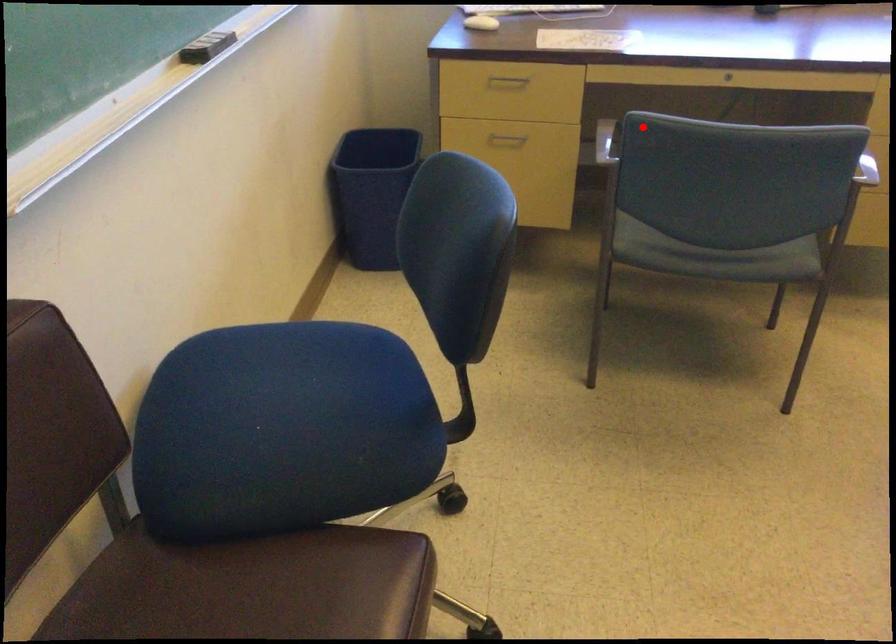
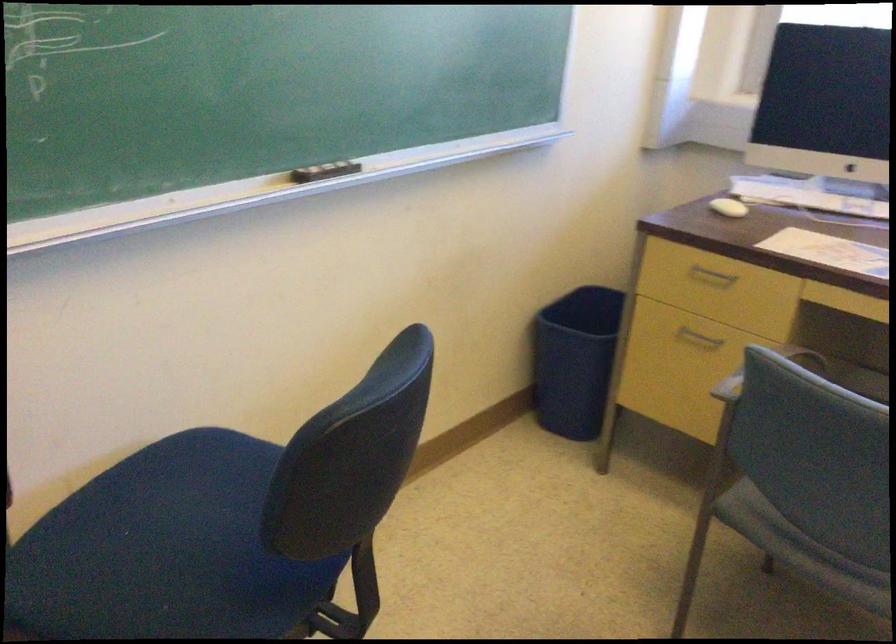
In the second image, find the point that corresponds to the highlighted location in the first image.

(764, 371)